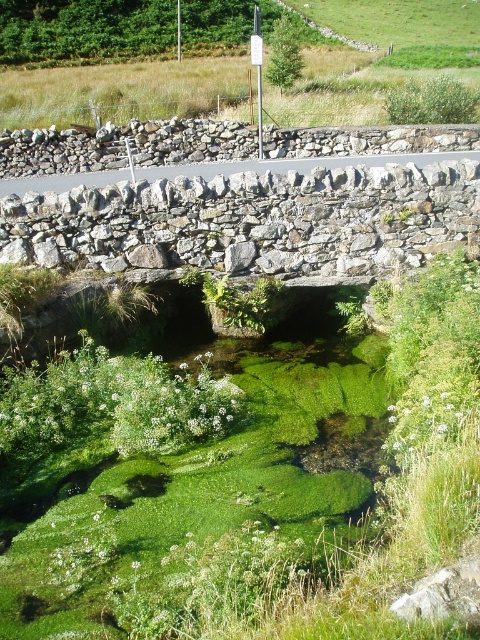
Can you confirm if gray rough stone bridge at center is thinner than gray rough stone at center?

Indeed, gray rough stone bridge at center has a lesser width compared to gray rough stone at center.

Is gray rough stone bridge at center taller than gray rough stone at center?

No, gray rough stone bridge at center is not taller than gray rough stone at center.

Does point (429, 172) come in front of point (215, 156)?

Yes, it is in front of point (215, 156).

This screenshot has height=640, width=480. Identify the location of gray rough stone bridge at center. (250, 220).